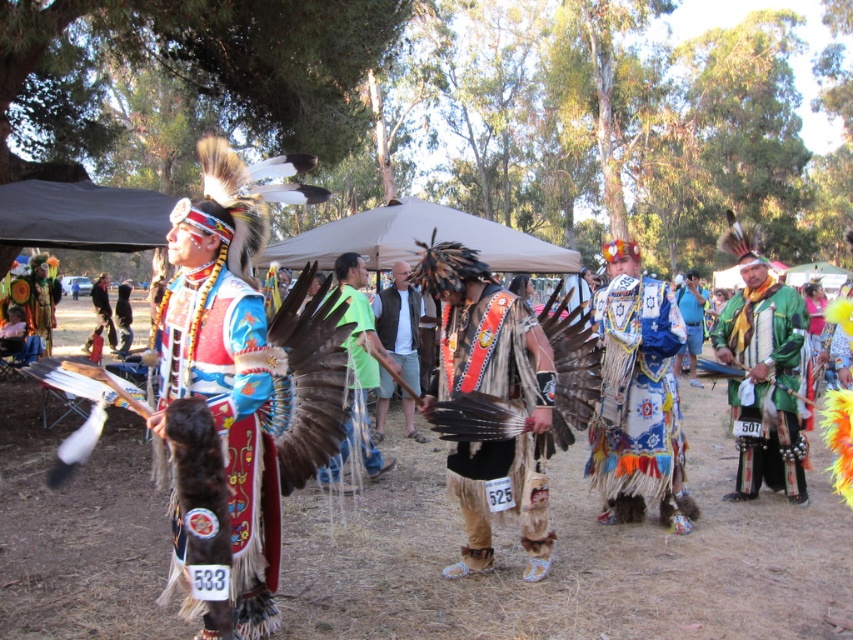
Can you confirm if green matte feathered headdress at right is thinner than matte blue feathered headdress at center?

Incorrect, green matte feathered headdress at right's width is not less than matte blue feathered headdress at center's.

Which is behind, point (780, 472) or point (105, 298)?

Point (105, 298)

Image resolution: width=853 pixels, height=640 pixels. I want to click on green matte feathered headdress at right, so click(764, 387).

Who is lower down, multicolored fabric headdress at center or matte black feathered headdress at left?

multicolored fabric headdress at center

The width and height of the screenshot is (853, 640). What do you see at coordinates (229, 416) in the screenshot? I see `multicolored fabric headdress at center` at bounding box center [229, 416].

You are a GUI agent. You are given a task and a screenshot of the screen. Output one action in this format:
    pyautogui.click(x=<x>, y=<y>)
    Task: Click on the multicolored fabric headdress at center
    
    Given the screenshot: What is the action you would take?
    pyautogui.click(x=229, y=416)

Is point (242, 305) farther from camera compared to point (492, 394)?

No, it is not.

Does point (230, 508) come closer to viewer compared to point (462, 316)?

Yes, point (230, 508) is closer to viewer.

Who is more distant from viewer, (268, 388) or (543, 534)?

The point (543, 534) is behind.

Locate an element on the screen. Image resolution: width=853 pixels, height=640 pixels. multicolored fabric headdress at center is located at coordinates (229, 416).